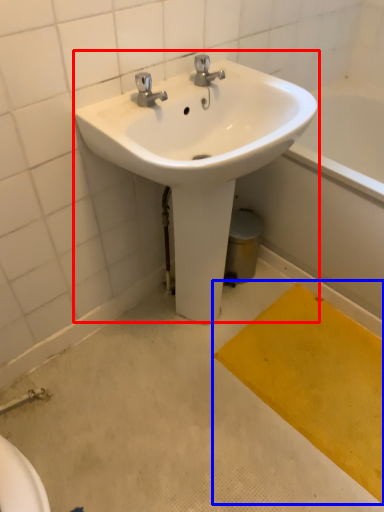
Question: Which point is closer to the camera, sink (highlighted by a red box) or doormat (highlighted by a blue box)?

Choices:
 (A) sink
 (B) doormat

Answer: (A)